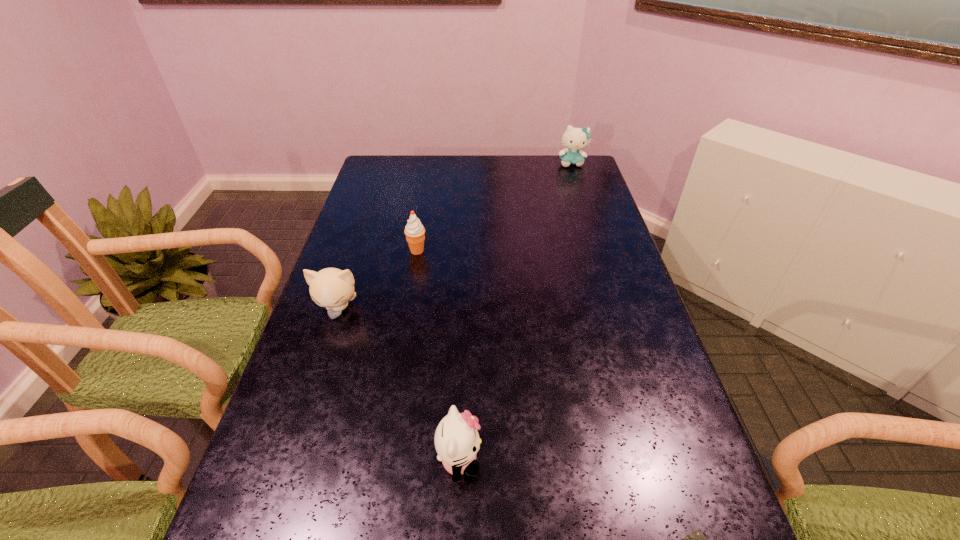
The height and width of the screenshot is (540, 960). In order to click on vacant region at the far right corner of the desktop in this screenshot , I will do `click(567, 177)`.

This screenshot has width=960, height=540. I want to click on blank region between the second farthest kitten and the second kitten from right to left, so click(398, 384).

Find the location of a particular element. The width and height of the screenshot is (960, 540). unoccupied area between the second kitten from right to left and the third nearest object is located at coordinates (398, 384).

Where is `vacant space that's between the icecream and the leftmost object`? This screenshot has width=960, height=540. vacant space that's between the icecream and the leftmost object is located at coordinates (377, 280).

Where is `empty location between the second farthest object and the fourth farthest object`? This screenshot has width=960, height=540. empty location between the second farthest object and the fourth farthest object is located at coordinates (438, 355).

Where is `free spot between the rightmost kitten and the third object from right to left`? free spot between the rightmost kitten and the third object from right to left is located at coordinates (516, 312).

Locate an element on the screen. free area in between the fourth farthest object and the leftmost kitten is located at coordinates (398, 384).

I want to click on unoccupied position between the third nearest object and the farthest kitten, so tap(455, 236).

The height and width of the screenshot is (540, 960). I want to click on free area in between the rightmost kitten and the second kitten from left to right, so click(516, 312).

Locate an element on the screen. The width and height of the screenshot is (960, 540). the third closest object to the third object from right to left is located at coordinates click(x=415, y=232).